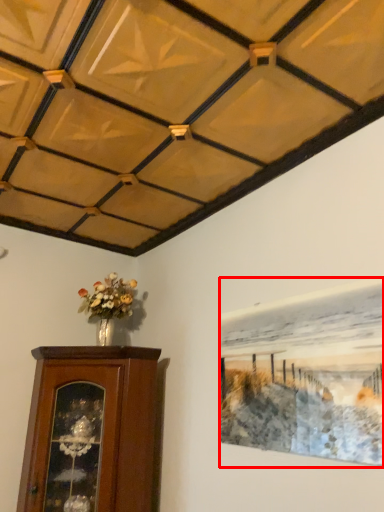
Question: From the image, what is the correct spatial relationship of picture frame (annotated by the red box) in relation to furniture?

Choices:
 (A) left
 (B) right

Answer: (B)